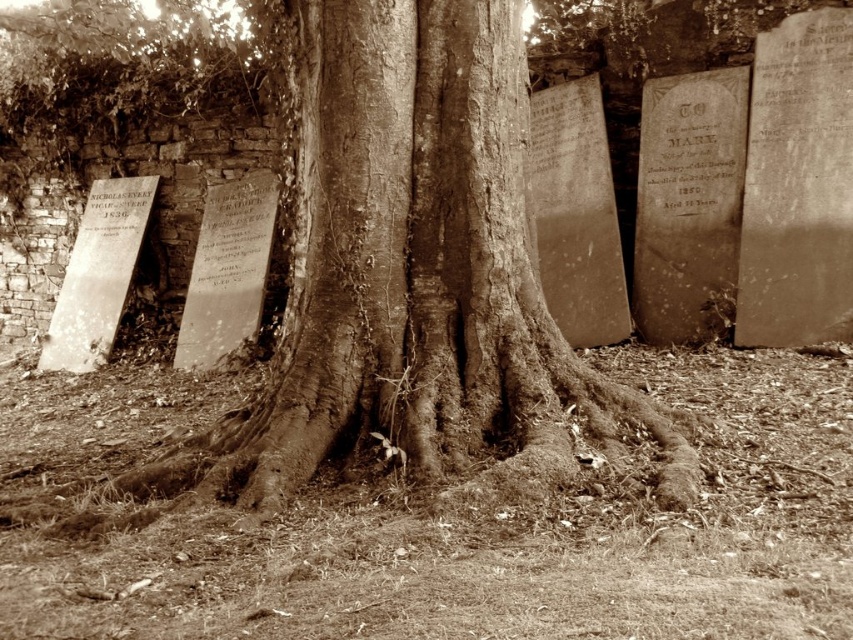
Consider the image. Is smooth bark tree at center below smooth stone inscription at center right?

Yes.

The image size is (853, 640). What do you see at coordinates (412, 275) in the screenshot?
I see `smooth bark tree at center` at bounding box center [412, 275].

Which is in front, point (375, 35) or point (660, 214)?

Positioned in front is point (375, 35).

Image resolution: width=853 pixels, height=640 pixels. Identify the location of smooth bark tree at center. (412, 275).

Which is behind, point (674, 145) or point (207, 250)?

The point (207, 250) is behind.

Does smooth stone inscription at center right appear over smooth stone plaque at center?

Correct, smooth stone inscription at center right is located above smooth stone plaque at center.

At what (x,y) coordinates should I click in order to perform the action: click on smooth stone inscription at center right. Please return your answer as a coordinate pair (x, y). This screenshot has height=640, width=853. Looking at the image, I should click on (691, 156).

Identify the location of smooth stone inscription at center right. (691, 156).

Is smooth bark tree at center shorter than smooth stone plaque at center?

In fact, smooth bark tree at center may be taller than smooth stone plaque at center.

Between smooth bark tree at center and smooth stone plaque at center, which one is positioned lower?

Positioned lower is smooth bark tree at center.

Describe the element at coordinates (412, 275) in the screenshot. I see `smooth bark tree at center` at that location.

Find the location of a particular element. This screenshot has height=640, width=853. smooth bark tree at center is located at coordinates (412, 275).